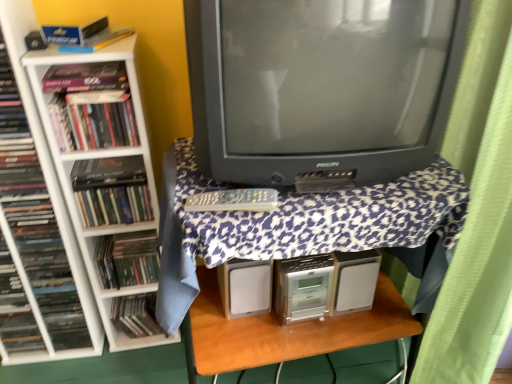
What is the approximate width of gray plastic remote at center?

The width of gray plastic remote at center is 6.67 centimeters.

Locate an element on the screen. gray plastic remote at center is located at coordinates (234, 200).

Measure the distance between matte black book at left, acting as the seventh book starting from the left, and camera.

The distance of matte black book at left, acting as the seventh book starting from the left, from camera is 4.15 feet.

Image resolution: width=512 pixels, height=384 pixels. I want to click on blue cardboard book at upper left, which is the 6th book from left to right, so click(x=84, y=36).

You are a GUI agent. You are given a task and a screenshot of the screen. Output one action in this format:
    pyautogui.click(x=<x>, y=<y>)
    Task: Click on the matte black book at left, the 7th book in the right-to-left sequence
    
    Given the screenshot: What is the action you would take?
    pyautogui.click(x=15, y=309)

From the picture: Is matte black book at left, the 7th book in the right-to-left sequence, turned away from gray plastic remote at center?

matte black book at left, the 7th book in the right-to-left sequence, does not have its back to gray plastic remote at center.

From the image's perspective, is matte black book at left, the 7th book in the right-to-left sequence, over gray plastic remote at center?

No, from the image's perspective, matte black book at left, the 7th book in the right-to-left sequence, is not over gray plastic remote at center.

From a real-world perspective, is matte black book at left, the 1th book from the left, over gray plastic remote at center?

No, from a real-world perspective, matte black book at left, the 1th book from the left, is not over gray plastic remote at center

Considering the sizes of matte black book at left, the 7th book in the right-to-left sequence, and gray plastic remote at center in the image, is matte black book at left, the 7th book in the right-to-left sequence, wider or thinner than gray plastic remote at center?

Considering their sizes, matte black book at left, the 7th book in the right-to-left sequence, looks broader than gray plastic remote at center.

Is point (15, 344) closer or farther from the camera than point (44, 42)?

Clearly, point (15, 344) is more distant from the camera than point (44, 42).

Considering the relative positions of matte black book at left, the 1th book from the left, and matte black speaker at upper left in the image provided, is matte black book at left, the 1th book from the left, in front of matte black speaker at upper left?

No, matte black book at left, the 1th book from the left, is further to the viewer.

Is matte black book at left, the 1th book from the left, taller than matte black speaker at upper left?

Yes.

Is matte black book at left, the 1th book from the left, oriented towards matte black speaker at upper left?

No, matte black book at left, the 1th book from the left, is not facing towards matte black speaker at upper left.

Can you confirm if matte black book at left, the 5th book positioned from the left, is taller than matte black book at left, the 1th book from the left?

Incorrect, the height of matte black book at left, the 5th book positioned from the left, is not larger of that of matte black book at left, the 1th book from the left.

Which is behind, matte black book at left, the 5th book positioned from the left, or matte black book at left, the 7th book in the right-to-left sequence?

Positioned behind is matte black book at left, the 5th book positioned from the left.

Is matte black book at left, the 5th book positioned from the left, thinner than matte black book at left, the 7th book in the right-to-left sequence?

Correct, the width of matte black book at left, the 5th book positioned from the left, is less than that of matte black book at left, the 7th book in the right-to-left sequence.

Which is nearer, (150, 197) or (4, 339)?

The point (150, 197) is more forward.

From the image's perspective, which one is positioned higher, green fabric curtain at right or matte black speaker at upper left?

matte black speaker at upper left.

Based on the photo, who is shorter, green fabric curtain at right or matte black speaker at upper left?

matte black speaker at upper left.

From a real-world perspective, is green fabric curtain at right positioned under matte black speaker at upper left based on gravity?

Indeed, from a real-world perspective, green fabric curtain at right is positioned beneath matte black speaker at upper left.

From a real-world perspective, is hardcover book at left, the 6th book positioned from the right, positioned under wooden table at center based on gravity?

Incorrect, from a real-world perspective, hardcover book at left, the 6th book positioned from the right, is higher than wooden table at center.

Is hardcover book at left, the 2th book in the left-to-right sequence, in front of or behind wooden table at center in the image?

hardcover book at left, the 2th book in the left-to-right sequence, is positioned farther from the viewer than wooden table at center.

Between hardcover book at left, the 6th book positioned from the right, and wooden table at center, which one appears on the right side from the viewer's perspective?

wooden table at center is more to the right.

Is hardcover book at left, the 6th book positioned from the right, taller than wooden table at center?

Yes, hardcover book at left, the 6th book positioned from the right, is taller than wooden table at center.

From the image's perspective, who appears lower, matte black speaker at upper left or blue cardboard book at upper left, which is the second book in right-to-left order?

From the image's view, matte black speaker at upper left is below.

Are matte black speaker at upper left and blue cardboard book at upper left, which is the 6th book from left to right, located far from each other?

Actually, matte black speaker at upper left and blue cardboard book at upper left, which is the 6th book from left to right, are a little close together.

Is matte black speaker at upper left facing towards blue cardboard book at upper left, which is the 6th book from left to right?

No, matte black speaker at upper left does not turn towards blue cardboard book at upper left, which is the 6th book from left to right.

Would you say blue cardboard book at upper left, which is the second book in right-to-left order, is part of matte black speaker at upper left's contents?

That's incorrect, blue cardboard book at upper left, which is the second book in right-to-left order, is not inside matte black speaker at upper left.

Between hardcover book at left and matte black book at left, the 5th book positioned from the left, which one has less height?

hardcover book at left.

Is hardcover book at left next to matte black book at left, the 5th book positioned from the left?

Yes, hardcover book at left is beside matte black book at left, the 5th book positioned from the left.

Consider the image. Is hardcover book at left located outside matte black book at left, the third book positioned from the right?

Yes, hardcover book at left is located beyond the bounds of matte black book at left, the third book positioned from the right.

The width and height of the screenshot is (512, 384). I want to click on the 7th book counting from the left side of the gray plastic remote at center, so click(15, 309).

Image resolution: width=512 pixels, height=384 pixels. Identify the location of the 5th book directly beneath the matte black speaker at upper left (from a real-world perspective). (15, 309).

Considering their positions, is matte black speaker at upper left positioned closer to hardcover book at left, the 2th book in the left-to-right sequence, than blue cardboard book at upper left, which is the second book in right-to-left order?

blue cardboard book at upper left, which is the second book in right-to-left order, is positioned closer to the anchor hardcover book at left, the 2th book in the left-to-right sequence.

Considering their positions, is hardcover book at left positioned further to matte black book at left, acting as the seventh book starting from the left, than matte black book at left, acting as the third book starting from the left?

Based on the image, hardcover book at left appears to be further to matte black book at left, acting as the seventh book starting from the left.

When comparing their distances from wooden table at center, does gray plastic remote at center or matte black speaker at upper left seem closer?

gray plastic remote at center is positioned closer to the anchor wooden table at center.

Looking at the image, which one is located further to white plastic bookcase at left, hardcover book at left or green fabric curtain at right?

green fabric curtain at right lies further to white plastic bookcase at left than the other object.

When comparing their distances from green fabric curtain at right, does wooden table at center or matte black television at center seem closer?

wooden table at center is closer to green fabric curtain at right.

In the scene shown: Which object lies nearer to the anchor point matte black book at left, the 1th book from the left, hardcover book at left, which is counted as the fourth book, starting from the left, or wooden table at center?

hardcover book at left, which is counted as the fourth book, starting from the left.

From the image, which object appears to be farther from hardcover book at left, which is counted as the fourth book, starting from the left, white plastic bookcase at left or matte black book at left, the 5th book positioned from the left?

matte black book at left, the 5th book positioned from the left, is further to hardcover book at left, which is counted as the fourth book, starting from the left.

Looking at the image, which one is located further to matte black speaker at upper left, matte black book at left, the 7th book in the right-to-left sequence, or matte black book at left, acting as the third book starting from the left?

matte black book at left, acting as the third book starting from the left, is further to matte black speaker at upper left.

Locate an element on the screen. The image size is (512, 384). remote between matte black television at center and matte black book at left, acting as the third book starting from the left, in the front-back direction is located at coordinates (234, 200).

The width and height of the screenshot is (512, 384). Find the location of `paperback book between blue cardboard book at upper left, which is the 6th book from left to right, and matte black book at left, acting as the third book starting from the left, in the vertical direction`. paperback book between blue cardboard book at upper left, which is the 6th book from left to right, and matte black book at left, acting as the third book starting from the left, in the vertical direction is located at coordinates (106, 172).

This screenshot has height=384, width=512. I want to click on bookcase located between hardcover book at left, the 6th book positioned from the right, and green fabric curtain at right in the left-right direction, so click(x=103, y=157).

Locate an element on the screen. The width and height of the screenshot is (512, 384). remote between matte black book at left, the 1th book from the left, and wooden table at center from left to right is located at coordinates (234, 200).